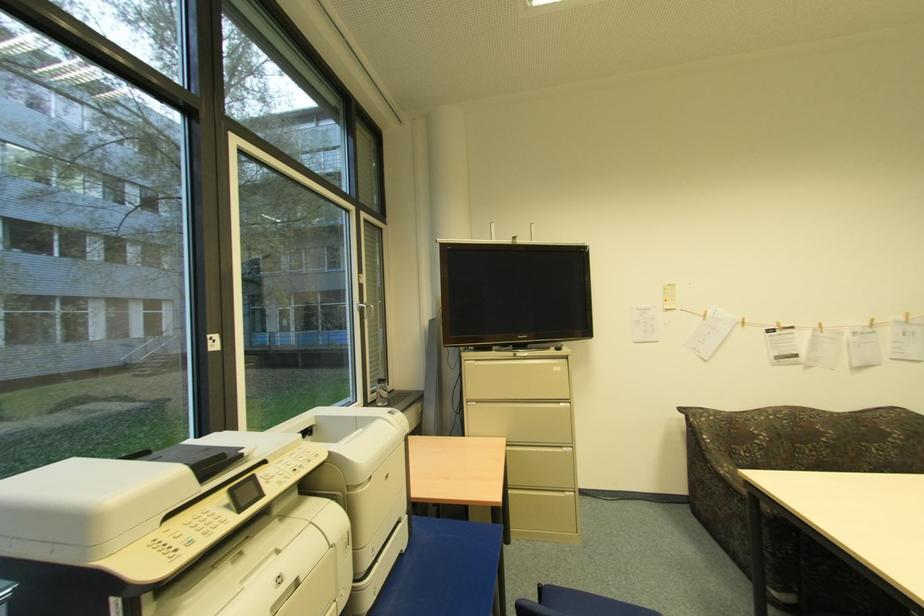
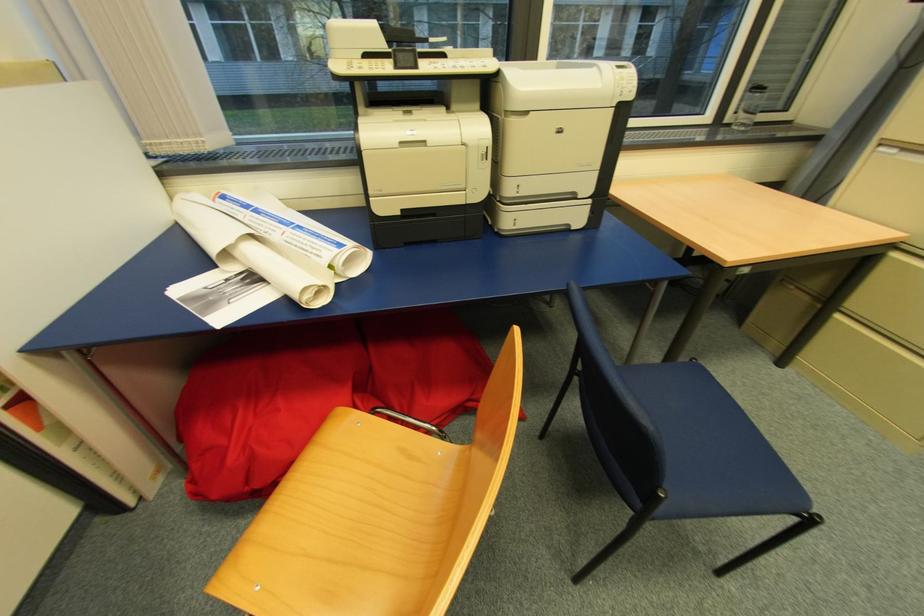
The point at (479, 402) is marked in the first image. Where is the corresponding point in the second image?

(902, 150)